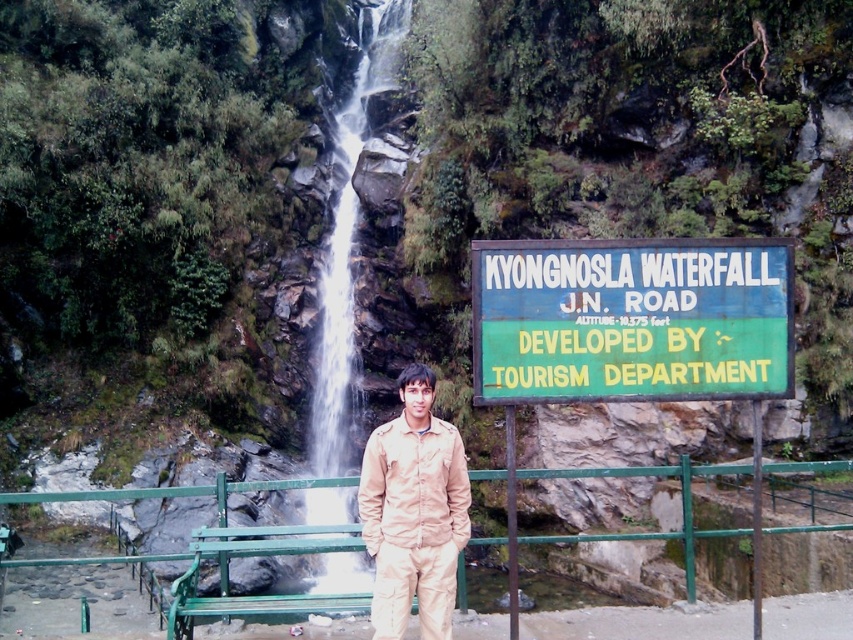
Question: Does green painted sign at right have a larger size compared to green painted wood park bench at lower center?

Choices:
 (A) yes
 (B) no

Answer: (B)

Question: Observing the image, what is the correct spatial positioning of beige fabric jacket at center in reference to white smooth water at center?

Choices:
 (A) left
 (B) right

Answer: (B)

Question: Which of the following is the farthest from the observer?

Choices:
 (A) (376, 600)
 (B) (515, 312)

Answer: (B)

Question: Can you confirm if green painted sign at right is positioned below beige fabric jacket at center?

Choices:
 (A) yes
 (B) no

Answer: (B)

Question: Among these points, which one is farthest from the camera?

Choices:
 (A) (717, 298)
 (B) (410, 394)
 (C) (354, 83)
 (D) (178, 611)

Answer: (C)

Question: Which object is positioned farthest from the green painted sign at right?

Choices:
 (A) white smooth water at center
 (B) green painted wood park bench at lower center
 (C) beige fabric jacket at center

Answer: (A)